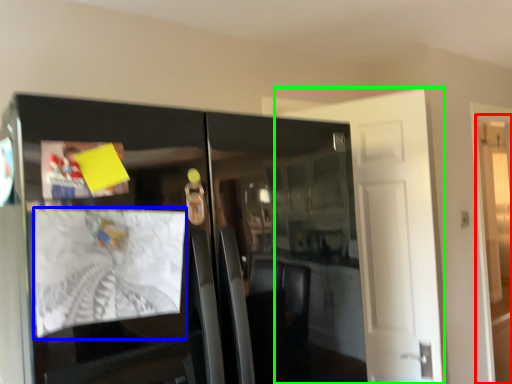
Question: Estimate the real-world distances between objects in this image. Which object is closer to door (highlighted by a red box), magazine (highlighted by a blue box) or door (highlighted by a green box)?

Choices:
 (A) magazine
 (B) door

Answer: (B)